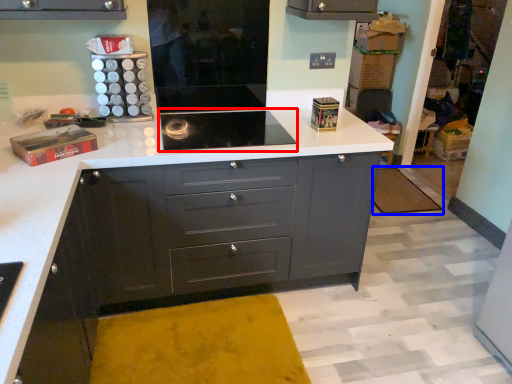
Question: Which object appears farthest to the camera in this image, home appliance (highlighted by a red box) or mat (highlighted by a blue box)?

Choices:
 (A) home appliance
 (B) mat

Answer: (B)